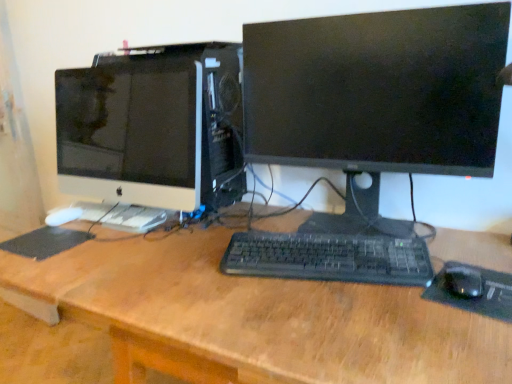
Question: Considering their positions, is wooden desk at center located in front of or behind black plastic keyboard at center?

Choices:
 (A) front
 (B) behind

Answer: (A)

Question: Do you think wooden desk at center is within black plastic keyboard at center, or outside of it?

Choices:
 (A) outside
 (B) inside

Answer: (A)

Question: Which of these objects is positioned farthest from the black rubber mousepad at lower right, which ranks as the 2th mousepad in back-to-front order?

Choices:
 (A) black plastic keyboard at center
 (B) white glossy computer monitor at left, the 2th computer monitor positioned from the right
 (C) white matte keyboard at left
 (D) wooden desk at center
 (E) black matte monitor at center, the second computer monitor from the left

Answer: (B)

Question: Which of these objects is positioned closest to the black matte monitor at center, which is counted as the first computer monitor, starting from the right?

Choices:
 (A) black rubber mousepad at lower right, which is the first mousepad from right to left
 (B) white matte keyboard at left
 (C) black plastic keyboard at center
 (D) white glossy computer monitor at left, positioned as the 1th computer monitor in left-to-right order
 (E) wooden desk at center

Answer: (C)